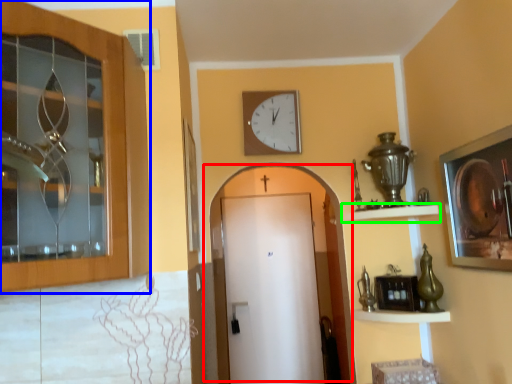
Question: Which object is positioned farthest from door (highlighted by a red box)? Select from door (highlighted by a blue box) and shelf (highlighted by a green box).

Choices:
 (A) door
 (B) shelf

Answer: (A)